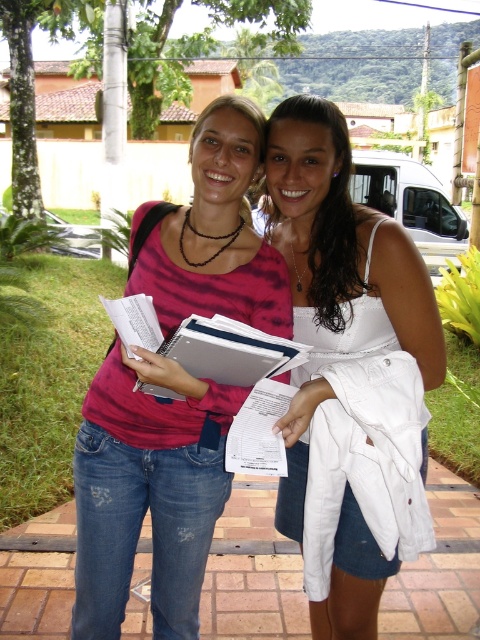
Question: Can you confirm if pink matte shirt at center is smaller than white satin tank top at center?

Choices:
 (A) no
 (B) yes

Answer: (A)

Question: Which object is the farthest from the white satin tank top at center?

Choices:
 (A) pink matte shirt at center
 (B) white fabric top at center

Answer: (A)

Question: Based on their relative distances, which object is nearer to the white satin tank top at center?

Choices:
 (A) white fabric top at center
 (B) pink matte shirt at center

Answer: (A)

Question: Considering the relative positions of pink matte shirt at center and white fabric top at center in the image provided, where is pink matte shirt at center located with respect to white fabric top at center?

Choices:
 (A) right
 (B) left

Answer: (B)

Question: Which point appears farthest from the camera in this image?

Choices:
 (A) (153, 362)
 (B) (331, 269)
 (C) (344, 616)

Answer: (C)

Question: Is pink matte shirt at center wider than white fabric top at center?

Choices:
 (A) yes
 (B) no

Answer: (A)